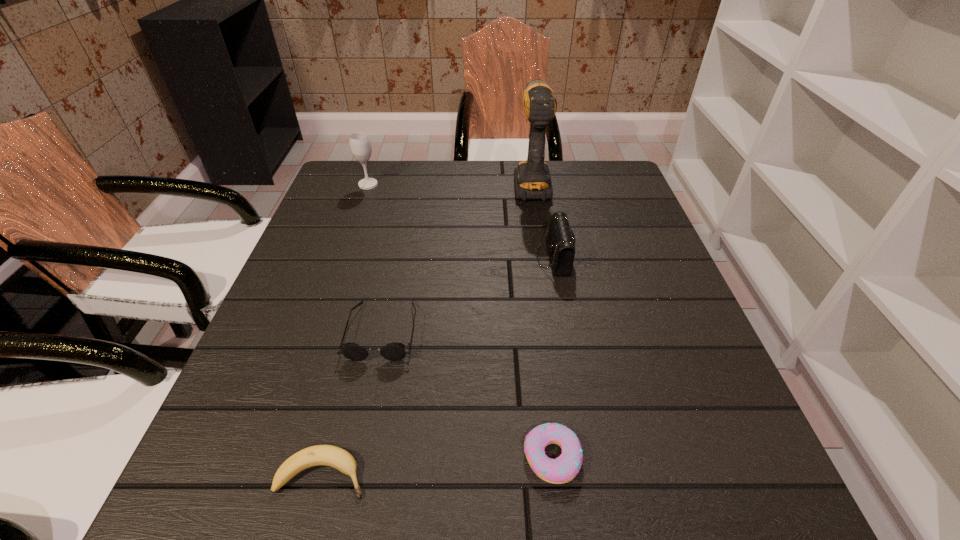
Select which object appears as the third closest to the doughnut. Please provide its 2D coordinates. Your answer should be formatted as a tuple, i.e. [(x, y)], where the tuple contains the x and y coordinates of a point satisfying the conditions above.

[(561, 240)]

Identify the location of vacant area that satisfies the following two spatial constraints: 1. on the front-facing side of the third shortest object; 2. at the stem of the banana. This screenshot has width=960, height=540. (352, 475).

Identify the location of vacant space that satisfies the following two spatial constraints: 1. on the front flap of the third farthest object; 2. on the front-facing side of the third shortest object. (567, 331).

Find the location of a particular element. Image resolution: width=960 pixels, height=540 pixels. free spot that satisfies the following two spatial constraints: 1. on the front-facing side of the third shortest object; 2. at the stem of the banana is located at coordinates (352, 475).

Find the location of a particular element. The image size is (960, 540). vacant space that satisfies the following two spatial constraints: 1. on the front flap of the clutch bag; 2. on the front-facing side of the fourth farthest object is located at coordinates (567, 331).

This screenshot has width=960, height=540. In order to click on vacant space that satisfies the following two spatial constraints: 1. on the front-facing side of the doughnut; 2. on the right side of the third nearest object in this screenshot , I will do `click(356, 457)`.